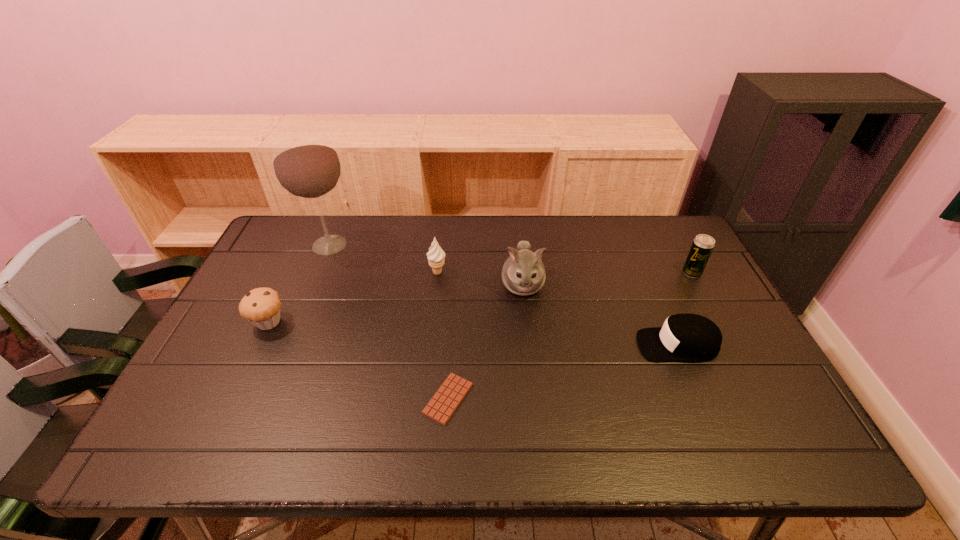
You are a GUI agent. You are given a task and a screenshot of the screen. Output one action in this format:
    pyautogui.click(x=<x>, y=<y>)
    Task: Click on the vacant space at the far right corner
    
    Given the screenshot: What is the action you would take?
    pyautogui.click(x=665, y=230)

Identify the location of free area in between the hamster and the cap. (600, 315).

I want to click on vacant area that lies between the sixth tallest object and the fifth tallest object, so pyautogui.click(x=473, y=333).

Image resolution: width=960 pixels, height=540 pixels. I want to click on free space between the third shortest object and the icecream, so click(353, 297).

Where is `free space between the cap and the rightmost object`? The height and width of the screenshot is (540, 960). free space between the cap and the rightmost object is located at coordinates (684, 309).

At what (x,y) coordinates should I click in order to perform the action: click on vacant area between the alcohol and the cap. Please return your answer as a coordinate pair (x, y). This screenshot has height=540, width=960. Looking at the image, I should click on (504, 295).

Where is `free spot between the muffin and the cap`? This screenshot has width=960, height=540. free spot between the muffin and the cap is located at coordinates (473, 333).

Where is `blank region between the fifth tallest object and the tallest object`? blank region between the fifth tallest object and the tallest object is located at coordinates (300, 284).

Where is `free area in between the hamster and the icecream`? This screenshot has height=540, width=960. free area in between the hamster and the icecream is located at coordinates (480, 279).

Choose which object is the fourth nearest neighbor to the candy bar. Please provide its 2D coordinates. Your answer should be formatted as a tuple, i.e. [(x, y)], where the tuple contains the x and y coordinates of a point satisfying the conditions above.

[(684, 337)]